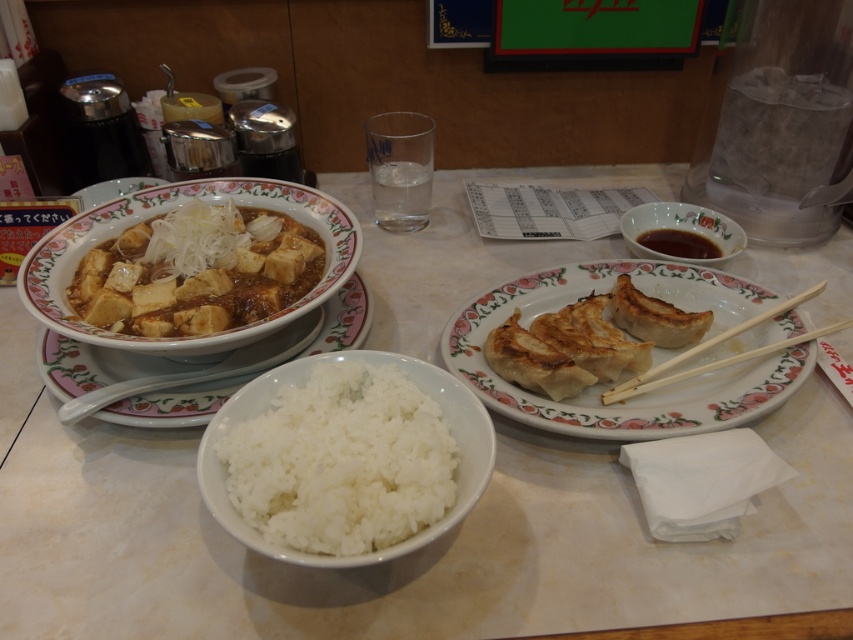
Between point (483, 513) and point (593, 284), which one is positioned behind?

Point (593, 284)

Is point (6, 422) positioned in front of point (724, 346)?

Yes, it is in front of point (724, 346).

Does point (366, 609) come farther from viewer compared to point (650, 275)?

No, it is not.

The height and width of the screenshot is (640, 853). What are the coordinates of `white glossy rice bowl at lower center` in the screenshot? It's located at (407, 556).

Can you confirm if matte ceramic bowl at center is positioned to the right of wooden chopsticks at right?

In fact, matte ceramic bowl at center is to the left of wooden chopsticks at right.

Does matte ceramic bowl at center appear under wooden chopsticks at right?

Correct, matte ceramic bowl at center is located below wooden chopsticks at right.

Where is `matte ceramic bowl at center`? matte ceramic bowl at center is located at coordinates (187, 368).

Based on the photo, does golden brown dough at center right come in front of wooden chopsticks at right?

Yes, it is in front of wooden chopsticks at right.

Describe the element at coordinates (624, 371) in the screenshot. This screenshot has height=640, width=853. I see `golden brown dough at center right` at that location.

This screenshot has height=640, width=853. I want to click on golden brown dough at center right, so click(x=624, y=371).